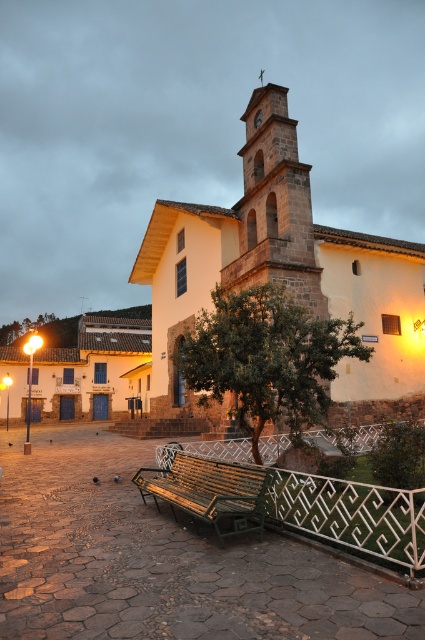
Question: Is dark brown stone bell tower at center to the left of green wooden bench at center from the viewer's perspective?

Choices:
 (A) no
 (B) yes

Answer: (A)

Question: Does white stone church at center have a smaller size compared to green wooden bench at center?

Choices:
 (A) yes
 (B) no

Answer: (B)

Question: Which point appears farthest from the camera in this image?

Choices:
 (A) (422, 284)
 (B) (317, 266)
 (C) (201, 513)

Answer: (A)

Question: Which point is farther from the camera taking this photo?

Choices:
 (A) (266, 275)
 (B) (249, 147)

Answer: (B)

Question: Can you confirm if white stone church at center is positioned below dark brown stone bell tower at center?

Choices:
 (A) no
 (B) yes

Answer: (B)

Question: Among these objects, which one is farthest from the camera?

Choices:
 (A) green wooden bench at center
 (B) white stone church at center

Answer: (B)